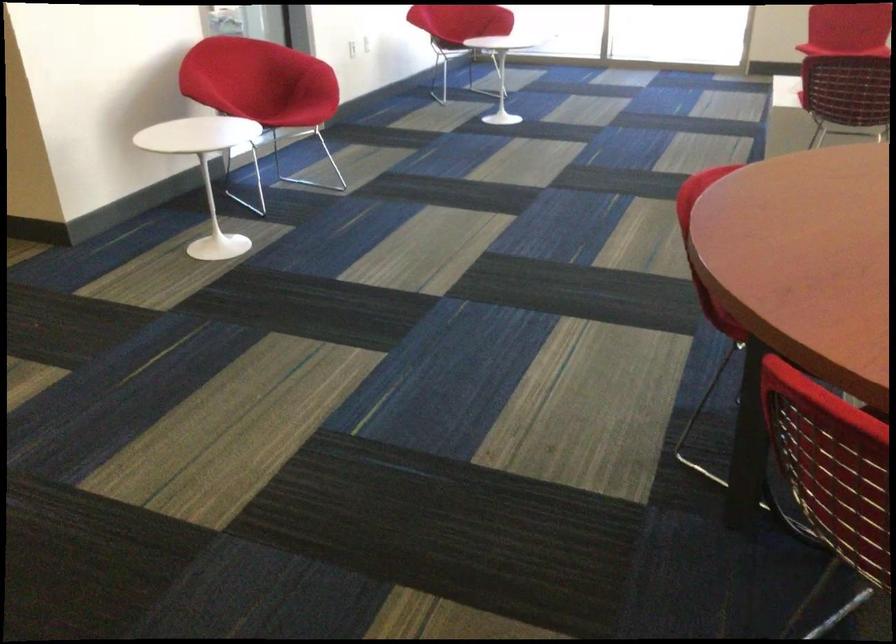
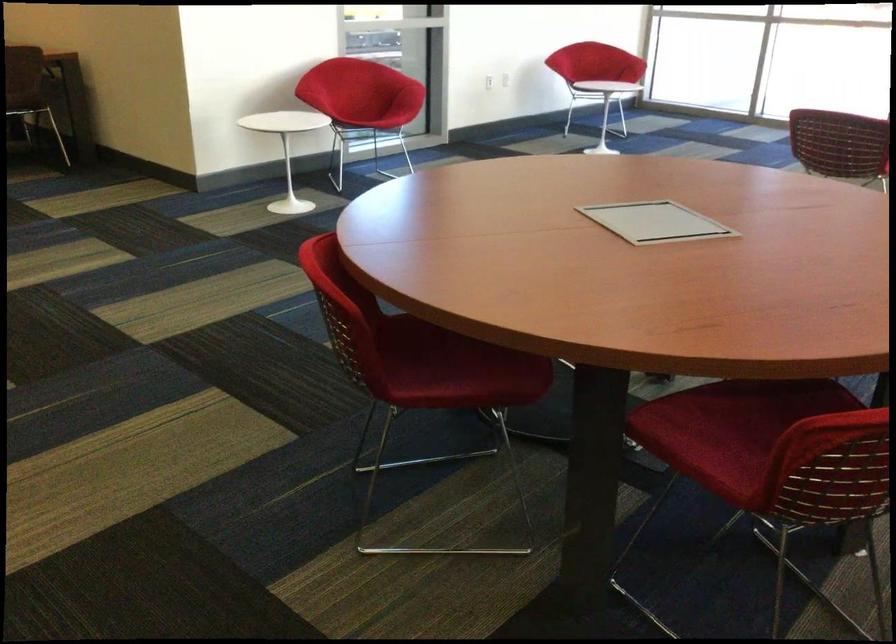
The point at (314, 73) is marked in the first image. Where is the corresponding point in the second image?

(406, 87)